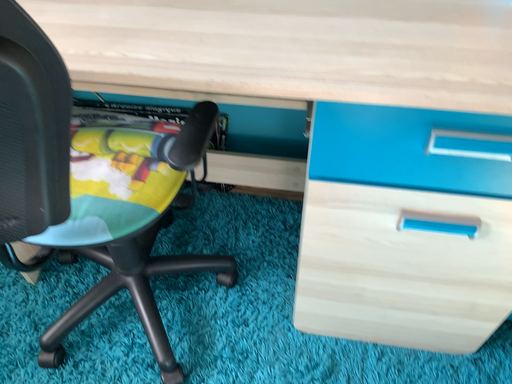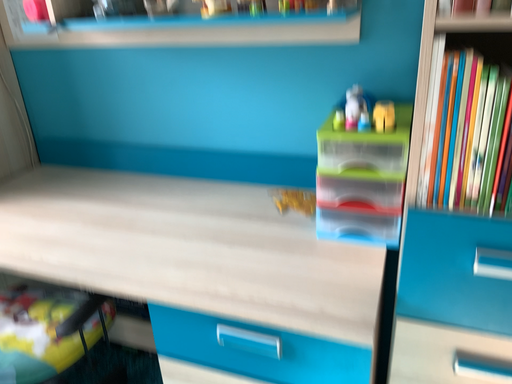
Question: Which way did the camera rotate in the video?

Choices:
 (A) rotated left
 (B) rotated right

Answer: (A)